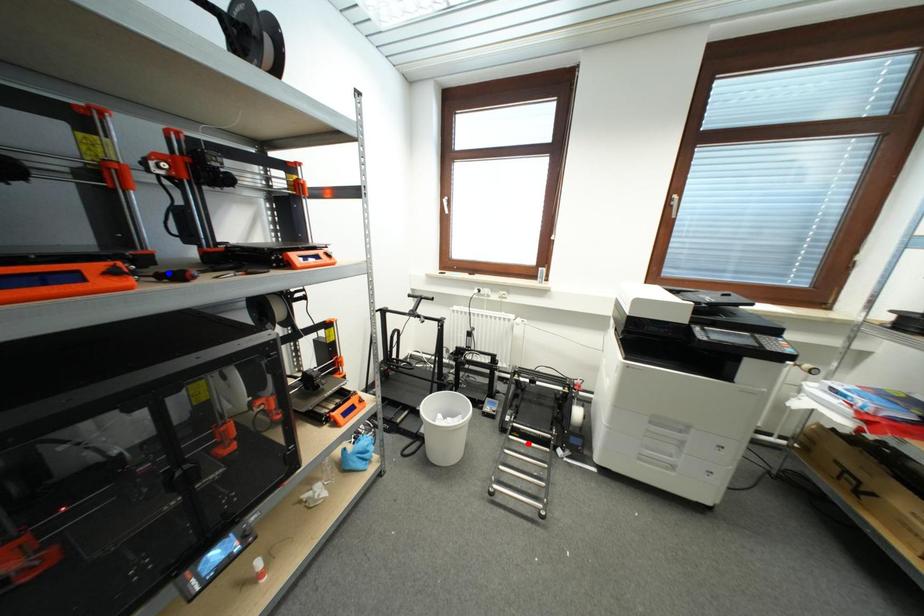
Question: Which of the two points in the image is closer to the camera?

Choices:
 (A) Blue point is closer.
 (B) Red point is closer.

Answer: (A)